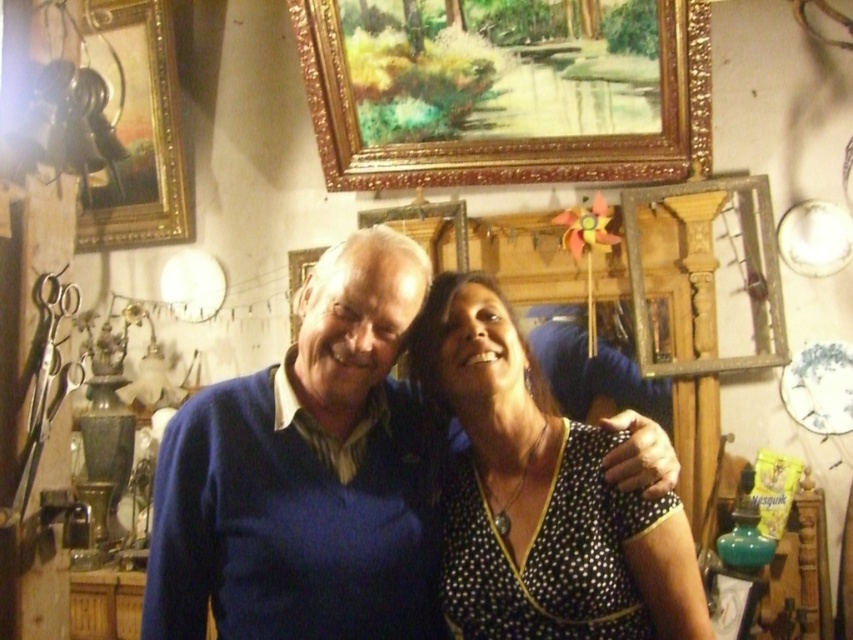
Does blue matte sweater at center come behind black dotted dress at center?

Yes.

Between blue matte sweater at center and black dotted dress at center, which one has less height?

Standing shorter between the two is black dotted dress at center.

Image resolution: width=853 pixels, height=640 pixels. Identify the location of blue matte sweater at center. (306, 476).

This screenshot has height=640, width=853. Describe the element at coordinates (540, 497) in the screenshot. I see `black dotted dress at center` at that location.

Is black dotted dress at center behind goldmetallicpicture frame at upper left?

No, black dotted dress at center is in front of goldmetallicpicture frame at upper left.

Who is more forward, [665,557] or [99,227]?

Point [665,557] is in front.

The image size is (853, 640). What are the coordinates of `black dotted dress at center` in the screenshot? It's located at (540, 497).

Can you confirm if gold ornate picture frame at upper center is shorter than goldmetallicpicture frame at upper left?

Yes.

Could you measure the distance between gold ornate picture frame at upper center and goldmetallicpicture frame at upper left?

The distance of gold ornate picture frame at upper center from goldmetallicpicture frame at upper left is 1.08 meters.

Describe the element at coordinates (505, 90) in the screenshot. I see `gold ornate picture frame at upper center` at that location.

Identify the location of gold ornate picture frame at upper center. Image resolution: width=853 pixels, height=640 pixels. (505, 90).